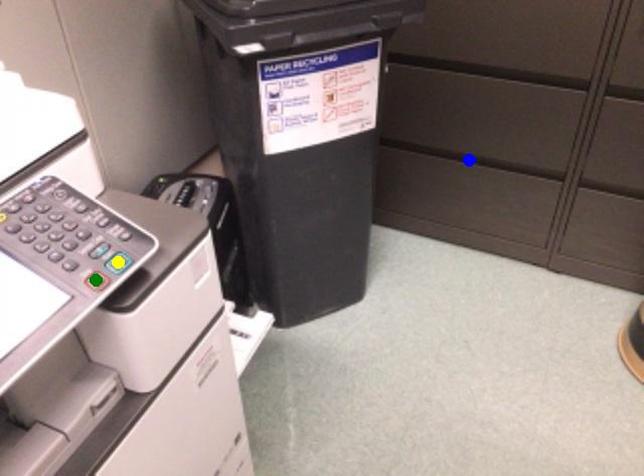
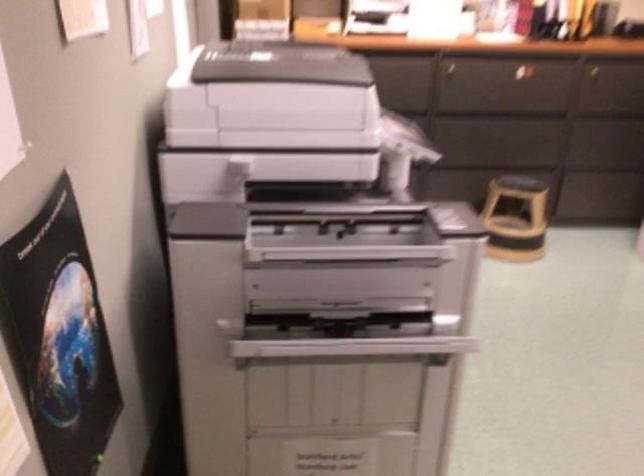
I am providing you with two images of the same scene from different viewpoints. Three points are marked in image1. Which point corresponds to a part or object that is occluded in image2?In image1, three points are marked. Which of them correspond to a part or object that is occluded in image2?Among the three points shown in image1, which one corresponds to a part or object that is no longer visible due to occlusion in image2?

Invisible in image2: green point, blue point, yellow point.